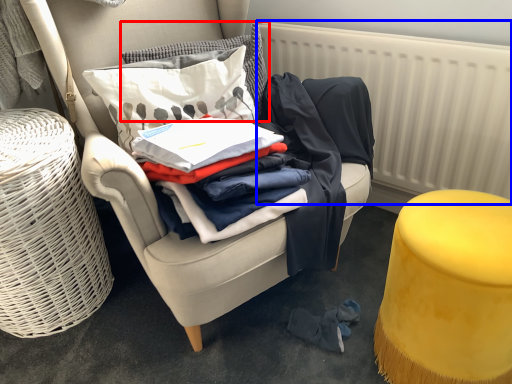
Question: Which of the following is the farthest to the observer, pillow (highlighted by a red box) or radiator (highlighted by a blue box)?

Choices:
 (A) pillow
 (B) radiator

Answer: (A)